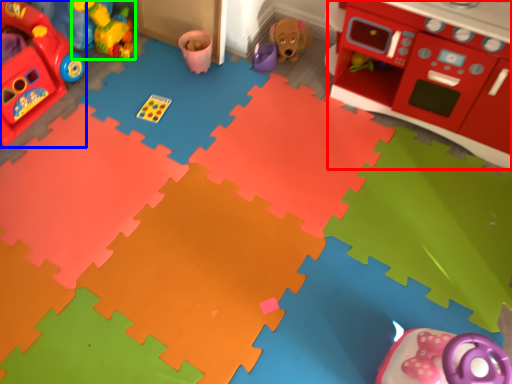
Question: Based on their relative distances, which object is farther from appliance (highlighted by a red box)? Choose from toy (highlighted by a blue box) and toy (highlighted by a green box).

Choices:
 (A) toy
 (B) toy

Answer: (A)